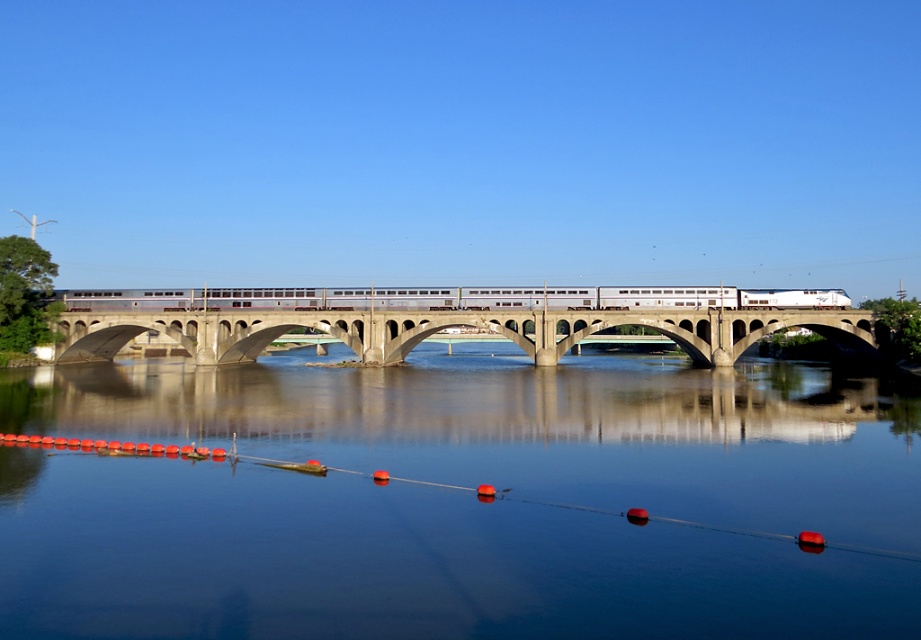
Question: Does concrete bridge at center appear on the right side of silver metallic train at center?

Choices:
 (A) no
 (B) yes

Answer: (A)

Question: Observing the image, what is the correct spatial positioning of concrete bridge at center in reference to silver metallic train at center?

Choices:
 (A) left
 (B) right

Answer: (A)

Question: Which of the following is the closest to the observer?

Choices:
 (A) (246, 300)
 (B) (651, 314)

Answer: (B)

Question: Among these points, which one is farthest from the camera?

Choices:
 (A) (736, 292)
 (B) (125, 468)

Answer: (A)

Question: Which of the following is the farthest from the observer?

Choices:
 (A) (422, 317)
 (B) (498, 625)

Answer: (A)

Question: Where is smooth water at center located in relation to silver metallic train at center in the image?

Choices:
 (A) right
 (B) left

Answer: (B)